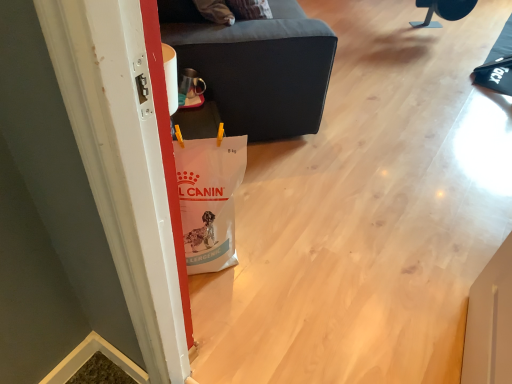
Question: In the image, is black plastic chair at upper right, which is counted as the first furniture, starting from the back, positioned in front of or behind dark gray fabric ottoman at center, the first furniture when ordered from bottom to top?

Choices:
 (A) behind
 (B) front

Answer: (A)

Question: From a real-world perspective, is black plastic chair at upper right, which appears as the 2th furniture when ordered from the bottom, physically located above or below dark gray fabric ottoman at center, arranged as the second furniture when viewed from the right?

Choices:
 (A) below
 (B) above

Answer: (A)

Question: From the image's perspective, is black plastic chair at upper right, which is the 1th furniture from right to left, positioned above or below dark gray fabric ottoman at center, marked as the 2th furniture in a top-to-bottom arrangement?

Choices:
 (A) below
 (B) above

Answer: (B)

Question: Does point (174, 44) appear closer or farther from the camera than point (423, 24)?

Choices:
 (A) closer
 (B) farther

Answer: (A)

Question: From the image's perspective, is dark gray fabric ottoman at center, the first furniture when ordered from bottom to top, located above or below black plastic chair at upper right, which ranks as the 1th furniture in top-to-bottom order?

Choices:
 (A) below
 (B) above

Answer: (A)

Question: Is dark gray fabric ottoman at center, the 1th furniture positioned from the left, inside the boundaries of black plastic chair at upper right, which ranks as the 1th furniture in top-to-bottom order, or outside?

Choices:
 (A) inside
 (B) outside

Answer: (B)

Question: Visually, is dark gray fabric ottoman at center, which appears as the 1th furniture when viewed from the front, positioned to the left or to the right of black plastic chair at upper right, which is the 1th furniture from right to left?

Choices:
 (A) left
 (B) right

Answer: (A)